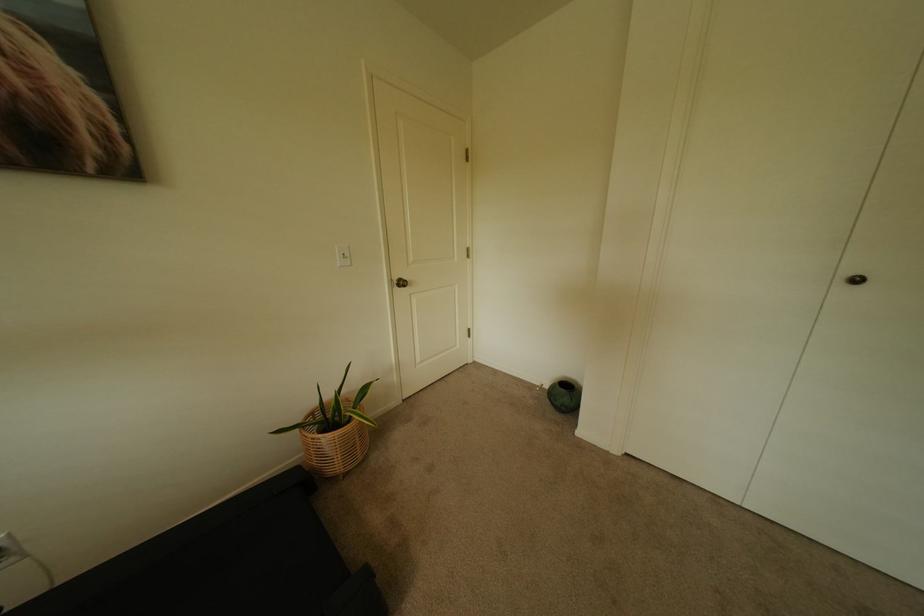
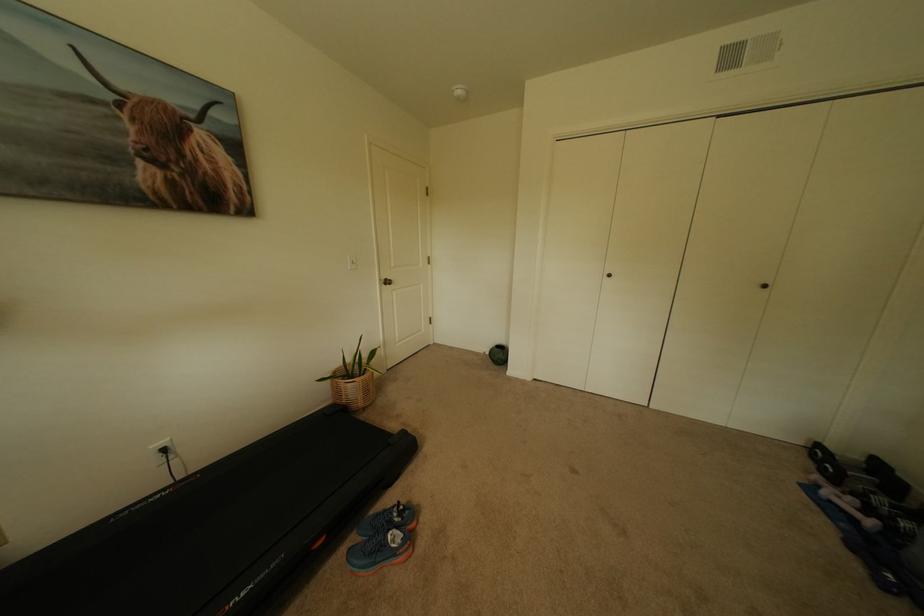
Where in the second image is the point corresponding to (x=347, y=458) from the first image?

(370, 395)